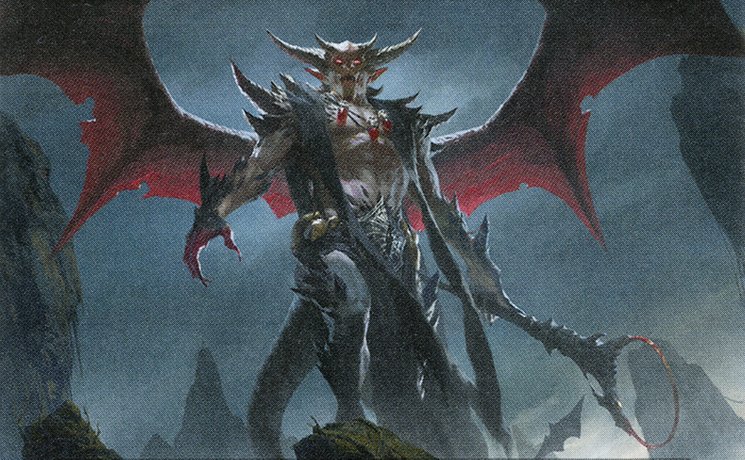
The height and width of the screenshot is (460, 745). What are the coordinates of `painting` in the screenshot? It's located at (456, 260).